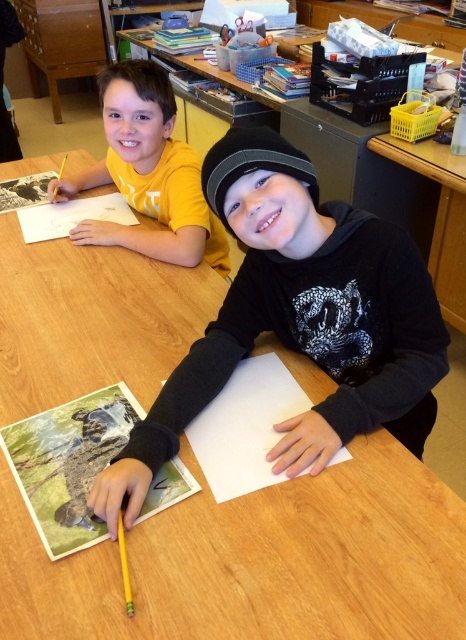
Question: Which of the following is the farthest from the observer?

Choices:
 (A) matte yellow shirt at upper left
 (B) wooden table at center

Answer: (B)

Question: Which point is farther to the camera?

Choices:
 (A) wooden table at center
 (B) matte yellow shirt at upper left
 (C) white paper at upper left
 (D) white paper at center

Answer: (A)

Question: Where is matte yellow shirt at upper left located in relation to white paper at upper left in the image?

Choices:
 (A) left
 (B) right

Answer: (B)

Question: Does wooden table at center appear over white paper at upper left?

Choices:
 (A) yes
 (B) no

Answer: (A)

Question: Which point appears farthest from the camera in this image?

Choices:
 (A) (163, 204)
 (B) (68, 202)
 (C) (274, 372)

Answer: (B)

Question: Can you confirm if wooden table at center is positioned to the right of matte yellow shirt at upper left?

Choices:
 (A) no
 (B) yes

Answer: (B)